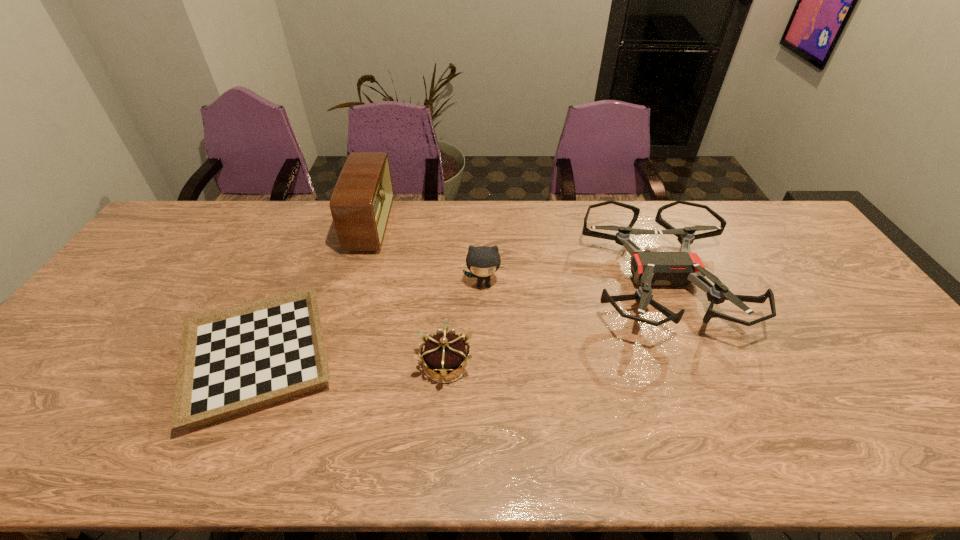
You are a GUI agent. You are given a task and a screenshot of the screen. Output one action in this format:
    pyautogui.click(x=<x>, y=<y>)
    Task: Click on the object that is the second nearest to the rightmost object
    Image resolution: width=960 pixels, height=540 pixels.
    Given the screenshot: What is the action you would take?
    pyautogui.click(x=443, y=353)

Identify the location of free point that satisfies the following two spatial constraints: 1. on the front-facing side of the crown; 2. on the right side of the tallest object. The height and width of the screenshot is (540, 960). (331, 364).

You are a GUI agent. You are given a task and a screenshot of the screen. Output one action in this format:
    pyautogui.click(x=<x>, y=<y>)
    Task: Click on the blank area in the image that satisfies the following two spatial constraints: 1. on the front-facing side of the radio receiver; 2. on the left side of the crown
    This screenshot has height=540, width=960.
    Given the screenshot: What is the action you would take?
    pyautogui.click(x=331, y=364)

You are a GUI agent. You are given a task and a screenshot of the screen. Output one action in this format:
    pyautogui.click(x=<x>, y=<y>)
    Task: Click on the free point that satisfies the following two spatial constraints: 1. on the front-facing side of the tallest object; 2. on the left side of the crown
    The image size is (960, 540).
    Given the screenshot: What is the action you would take?
    pyautogui.click(x=331, y=364)